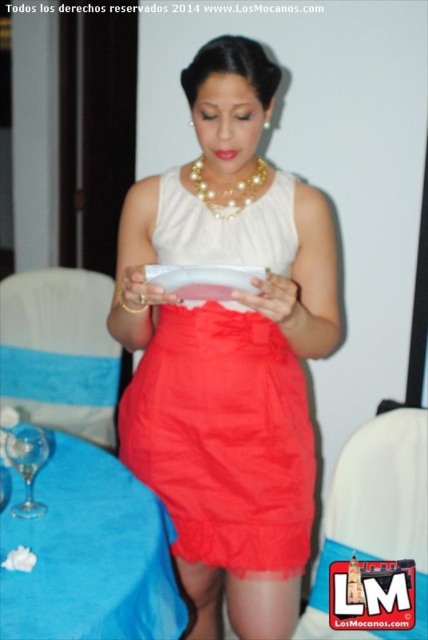
Question: Where is blue fabric table at lower left located in relation to pearl/textured necklace at center in the image?

Choices:
 (A) above
 (B) below

Answer: (B)

Question: Which point is closer to the camera?

Choices:
 (A) white satin dress at center
 (B) pearl/textured necklace at center
 (C) blue fabric table at lower left

Answer: (C)

Question: From the image, what is the correct spatial relationship of white satin dress at center in relation to blue fabric table at lower left?

Choices:
 (A) above
 (B) below

Answer: (A)

Question: Which of the following is the closest to the observer?

Choices:
 (A) blue fabric table at lower left
 (B) white satin dress at center

Answer: (A)

Question: Which object is closer to the camera taking this photo?

Choices:
 (A) blue fabric table at lower left
 (B) white satin dress at center

Answer: (A)

Question: Where is white satin dress at center located in relation to blue fabric table at lower left in the image?

Choices:
 (A) below
 (B) above

Answer: (B)